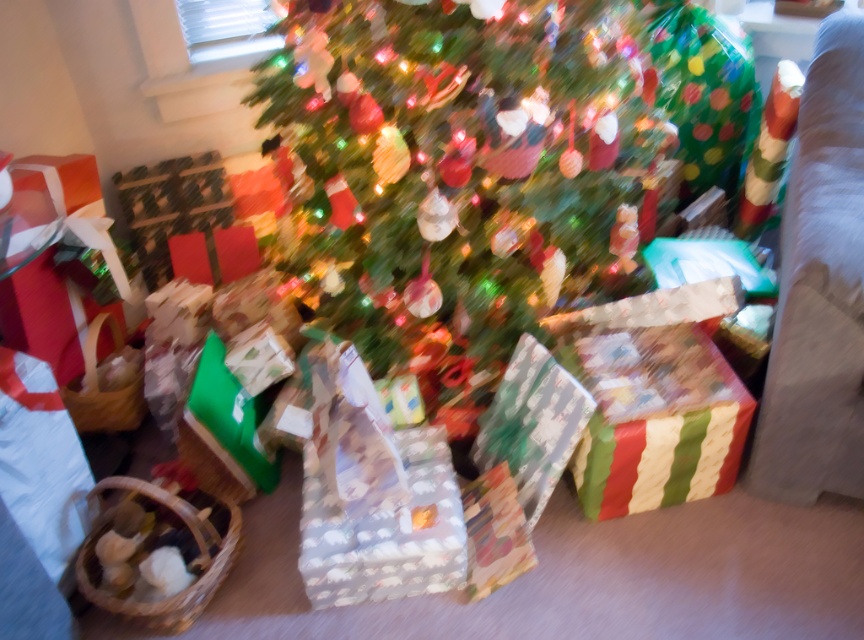
Which of these two, shiny green tree at center or white fabric armchair at right, stands taller?

Standing taller between the two is white fabric armchair at right.

Does shiny green tree at center appear on the right side of white fabric armchair at right?

No, shiny green tree at center is not to the right of white fabric armchair at right.

Is point (345, 54) less distant than point (793, 225)?

That is True.

Image resolution: width=864 pixels, height=640 pixels. What are the coordinates of `shiny green tree at center` in the screenshot? It's located at (456, 172).